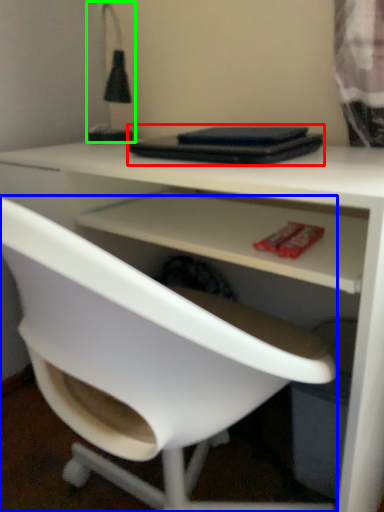
Question: Which is nearer to the laptop (highlighted by a red box)? chair (highlighted by a blue box) or table lamp (highlighted by a green box).

Choices:
 (A) chair
 (B) table lamp

Answer: (B)